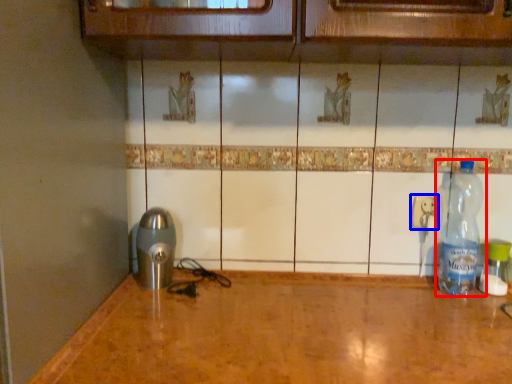
Question: Which point is closer to the camera, bottle (highlighted by a red box) or electric outlet (highlighted by a blue box)?

Choices:
 (A) bottle
 (B) electric outlet

Answer: (A)